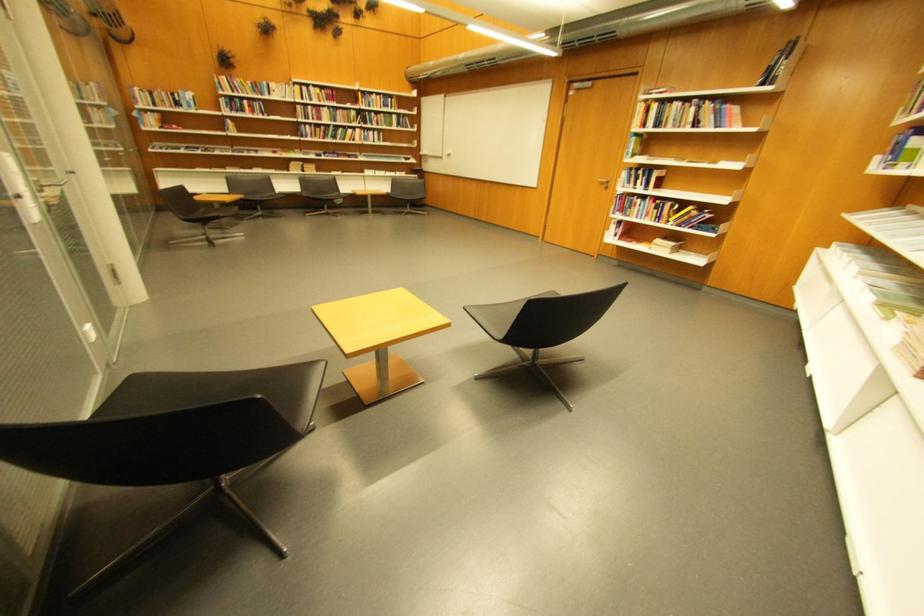
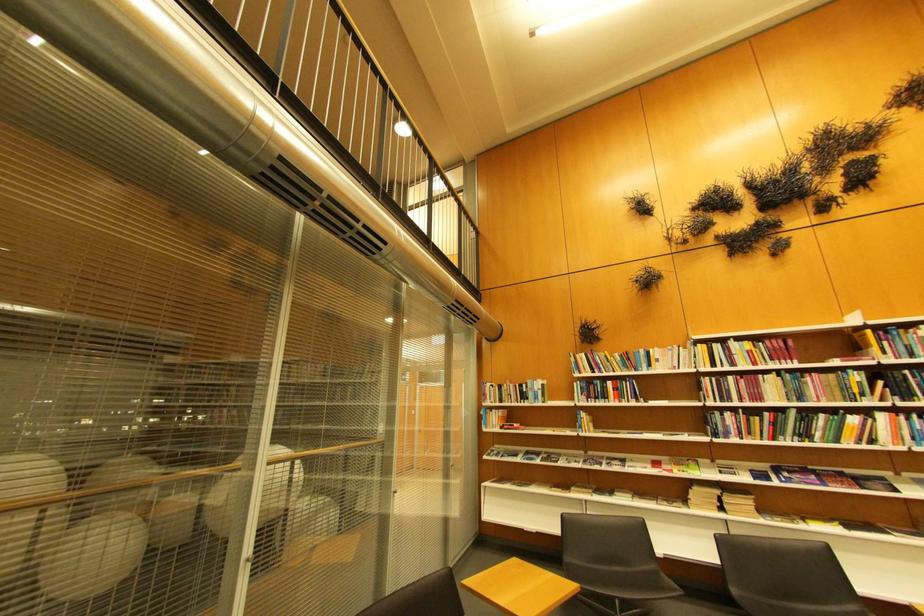
Question: I am providing you with two images of the same scene from different viewpoints. Please identify which objects are invisible in image2.

Choices:
 (A) journal on shelf
 (B) black chair sitting surface
 (C) book on shelf
 (D) none of these

Answer: (D)